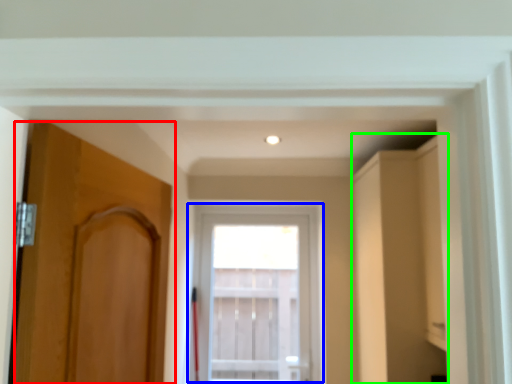
Question: Which object is positioned farthest from door (highlighted by a red box)? Select from window (highlighted by a blue box) and cabinetry (highlighted by a green box).

Choices:
 (A) window
 (B) cabinetry

Answer: (A)